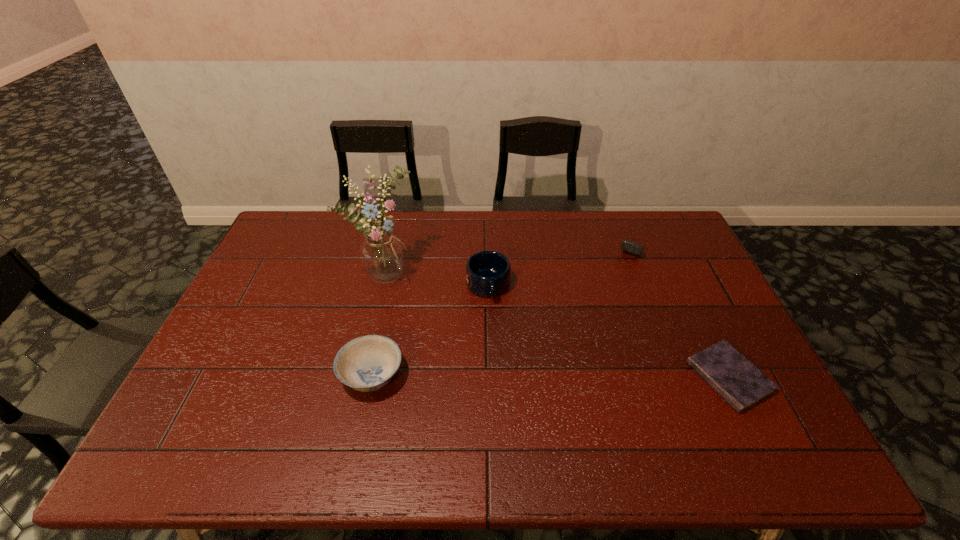
Where is `free space on the desktop that is between the third tallest object and the diary and is positioned on the front-facing side of the fourth tallest object`? The width and height of the screenshot is (960, 540). free space on the desktop that is between the third tallest object and the diary and is positioned on the front-facing side of the fourth tallest object is located at coordinates (561, 376).

You are a GUI agent. You are given a task and a screenshot of the screen. Output one action in this format:
    pyautogui.click(x=<x>, y=<y>)
    Task: Click on the free space on the desktop that is between the bowl and the shortest object and is positioned with the handle on the side of the fourth shortest object
    
    Given the screenshot: What is the action you would take?
    pyautogui.click(x=508, y=376)

At what (x,y) coordinates should I click in order to perform the action: click on free space on the desktop that is between the bowl and the diary and is positioned on the front-facing side of the tallest object. Please return your answer as a coordinate pair (x, y). The height and width of the screenshot is (540, 960). Looking at the image, I should click on (572, 376).